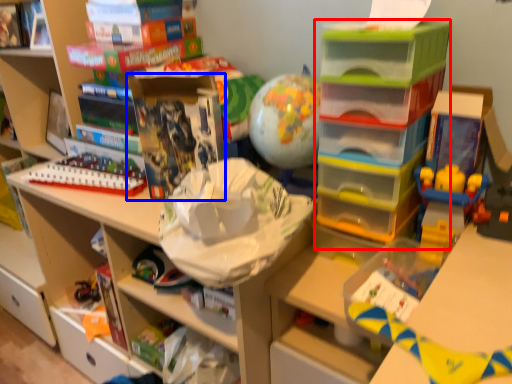
Question: Which object is further to the camera taking this photo, shelf (highlighted by a red box) or book (highlighted by a blue box)?

Choices:
 (A) shelf
 (B) book

Answer: (B)